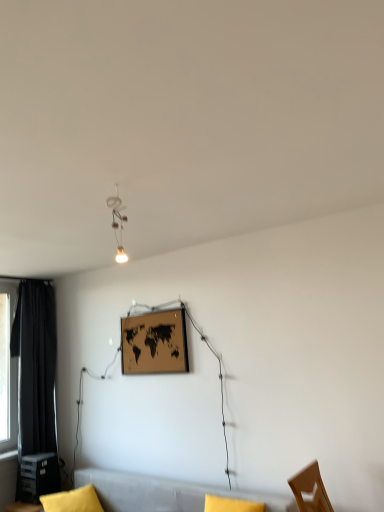
Looking at this image, measure the distance between point [55,338] and camera.

A distance of 14.07 feet exists between point [55,338] and camera.

This screenshot has height=512, width=384. I want to click on matte white lamp at upper center, so click(118, 224).

Measure the distance between point (115, 231) and camera.

The distance of point (115, 231) from camera is 2.90 meters.

Where is `wooden map at center`? This screenshot has height=512, width=384. wooden map at center is located at coordinates (154, 343).

Where is `matte black plastic table at lower left`? Image resolution: width=384 pixels, height=512 pixels. matte black plastic table at lower left is located at coordinates (38, 476).

What is the approximate height of yellow fabric pillow at lower left?

It is 4.85 inches.

Locate an element on the screen. Image resolution: width=384 pixels, height=512 pixels. soft gray couch at lower center is located at coordinates (144, 495).

Considering the sizes of black fabric curtain at left and wooden map at center in the image, is black fabric curtain at left taller or shorter than wooden map at center?

black fabric curtain at left is taller than wooden map at center.

Who is bigger, black fabric curtain at left or wooden map at center?

With larger size is black fabric curtain at left.

Is black fabric curtain at left far from wooden map at center?

Indeed, black fabric curtain at left is not near wooden map at center.

Considering the sizes of black fabric curtain at left and wooden map at center in the image, is black fabric curtain at left wider or thinner than wooden map at center?

Clearly, black fabric curtain at left has more width compared to wooden map at center.

From the image's perspective, relative to matte black plastic table at lower left, is matte white lamp at upper center above or below?

matte white lamp at upper center is above matte black plastic table at lower left.

Which object is positioned more to the left, matte white lamp at upper center or matte black plastic table at lower left?

Positioned to the left is matte black plastic table at lower left.

Which object is more forward, matte white lamp at upper center or matte black plastic table at lower left?

matte white lamp at upper center is closer to the camera.

From a real-world perspective, is matte white lamp at upper center below matte black plastic table at lower left?

Actually, matte white lamp at upper center is physically above matte black plastic table at lower left in the real world.

Is matte white lamp at upper center placed right next to black fabric curtain at left?

matte white lamp at upper center and black fabric curtain at left are clearly separated.

Is matte white lamp at upper center further to camera compared to black fabric curtain at left?

No, matte white lamp at upper center is in front of black fabric curtain at left.

Is matte white lamp at upper center inside or outside of black fabric curtain at left?

matte white lamp at upper center is not enclosed by black fabric curtain at left.

Could you tell me if matte white lamp at upper center is turned towards black fabric curtain at left?

No, matte white lamp at upper center is not facing towards black fabric curtain at left.

Looking at this image, does wooden map at center touch matte white lamp at upper center?

No, wooden map at center is not making contact with matte white lamp at upper center.

How different are the orientations of wooden map at center and matte white lamp at upper center in degrees?

wooden map at center and matte white lamp at upper center are facing 8.72 degrees away from each other.

Does wooden map at center lie behind matte white lamp at upper center?

Yes, the depth of wooden map at center is greater than that of matte white lamp at upper center.

From a real-world perspective, between wooden map at center and matte white lamp at upper center, who is vertically lower?

In real-world perspective, wooden map at center is lower.

Is the surface of soft gray couch at lower center in direct contact with matte white lamp at upper center?

No, soft gray couch at lower center is not beside matte white lamp at upper center.

From their relative heights in the image, would you say soft gray couch at lower center is taller or shorter than matte white lamp at upper center?

soft gray couch at lower center is taller than matte white lamp at upper center.

Could you tell me if soft gray couch at lower center is facing matte white lamp at upper center?

No, soft gray couch at lower center is not facing towards matte white lamp at upper center.

Is black fabric curtain at left beside matte white lamp at upper center?

No, black fabric curtain at left is not next to matte white lamp at upper center.

Is black fabric curtain at left completely or partially outside of matte white lamp at upper center?

Yes, black fabric curtain at left is located beyond the bounds of matte white lamp at upper center.

Which is more to the right, black fabric curtain at left or matte white lamp at upper center?

Positioned to the right is matte white lamp at upper center.

Between matte white lamp at upper center and soft gray couch at lower center, which one appears on the right side from the viewer's perspective?

From the viewer's perspective, matte white lamp at upper center appears more on the right side.

Is the position of matte white lamp at upper center more distant than that of soft gray couch at lower center?

No.

Looking at this image, is matte white lamp at upper center wider than soft gray couch at lower center?

No.

Is matte white lamp at upper center bigger than soft gray couch at lower center?

Incorrect, matte white lamp at upper center is not larger than soft gray couch at lower center.

The image size is (384, 512). In order to click on curtain below the wooden map at center (from a real-world perspective) in this screenshot , I will do `click(35, 366)`.

Locate an element on the screen. lamp in front of the matte black plastic table at lower left is located at coordinates (118, 224).

Based on their spatial positions, is matte white lamp at upper center or wooden map at center closer to black fabric curtain at left?

wooden map at center is closer to black fabric curtain at left.

From the image, which object appears to be farther from black fabric curtain at left, soft gray couch at lower center or matte black plastic table at lower left?

Among the two, soft gray couch at lower center is located further to black fabric curtain at left.

Considering their positions, is soft gray couch at lower center positioned closer to yellow fabric pillow at lower left than matte white lamp at upper center?

Among the two, soft gray couch at lower center is located nearer to yellow fabric pillow at lower left.

From the image, which object appears to be nearer to black fabric curtain at left, soft gray couch at lower center or yellow fabric pillow at lower left?

Among the two, yellow fabric pillow at lower left is located nearer to black fabric curtain at left.

Based on their spatial positions, is yellow fabric pillow at lower left or matte white lamp at upper center closer to soft gray couch at lower center?

yellow fabric pillow at lower left is closer to soft gray couch at lower center.

From the picture: From the image, which object appears to be nearer to wooden map at center, matte white lamp at upper center or soft gray couch at lower center?

soft gray couch at lower center lies closer to wooden map at center than the other object.

Which object lies nearer to the anchor point matte white lamp at upper center, yellow fabric pillow at lower left or wooden map at center?

wooden map at center is closer to matte white lamp at upper center.

Estimate the real-world distances between objects in this image. Which object is closer to soft gray couch at lower center, wooden map at center or matte black plastic table at lower left?

matte black plastic table at lower left lies closer to soft gray couch at lower center than the other object.

At what (x,y) coordinates should I click in order to perform the action: click on table between wooden map at center and yellow fabric pillow at lower left in the up-down direction. Please return your answer as a coordinate pair (x, y). The width and height of the screenshot is (384, 512). Looking at the image, I should click on (38, 476).

Locate an element on the screen. picture frame that lies between matte white lamp at upper center and soft gray couch at lower center from top to bottom is located at coordinates (154, 343).

The image size is (384, 512). I want to click on table between matte white lamp at upper center and yellow fabric pillow at lower left vertically, so click(38, 476).

Where is `table situated between black fabric curtain at left and wooden map at center from left to right`? table situated between black fabric curtain at left and wooden map at center from left to right is located at coordinates (38, 476).